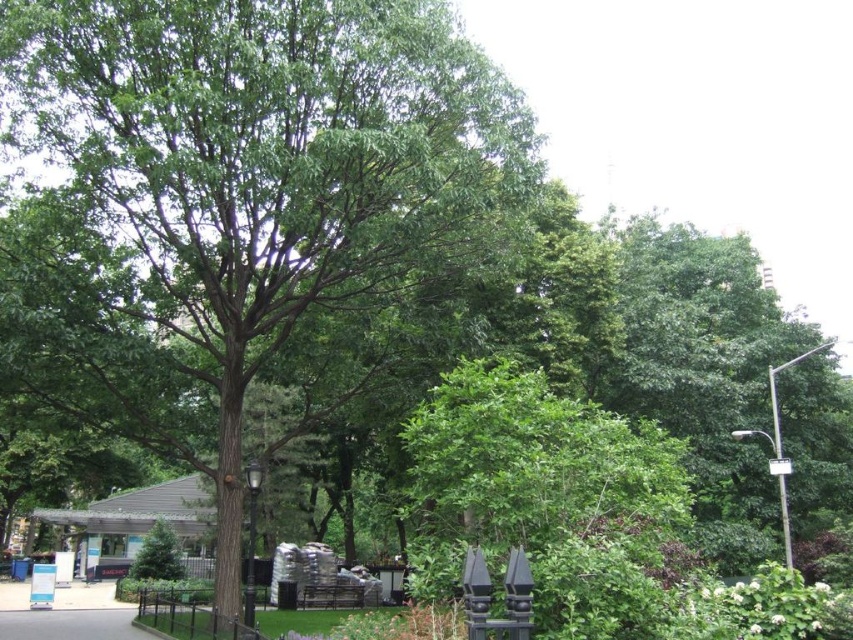
Is black metal fence at lower left further to camera compared to gray asphalt pavement at lower left?

No, black metal fence at lower left is in front of gray asphalt pavement at lower left.

The height and width of the screenshot is (640, 853). What do you see at coordinates (189, 616) in the screenshot?
I see `black metal fence at lower left` at bounding box center [189, 616].

Locate an element on the screen. The width and height of the screenshot is (853, 640). black metal fence at lower left is located at coordinates (189, 616).

Can you confirm if green leafy tree at center is shorter than black metal fence at lower left?

No, green leafy tree at center is not shorter than black metal fence at lower left.

Identify the location of green leafy tree at center. This screenshot has height=640, width=853. (247, 188).

Is green leafy tree at center positioned in front of gray asphalt pavement at lower left?

Yes, green leafy tree at center is in front of gray asphalt pavement at lower left.

Is green leafy tree at center bigger than gray asphalt pavement at lower left?

Yes.

The height and width of the screenshot is (640, 853). What do you see at coordinates (247, 188) in the screenshot? I see `green leafy tree at center` at bounding box center [247, 188].

Identify the location of green leafy tree at center. (247, 188).